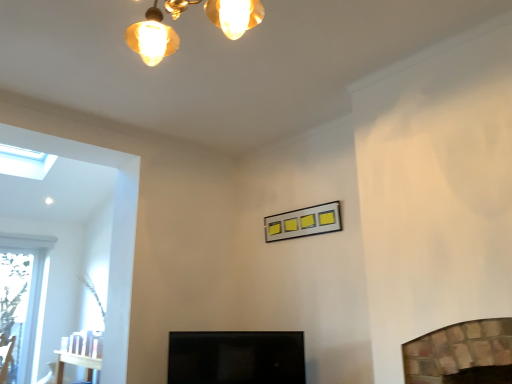
Question: Considering the relative sizes of black glossy screen door at center and metallic silver picture frame at center in the image provided, is black glossy screen door at center thinner than metallic silver picture frame at center?

Choices:
 (A) yes
 (B) no

Answer: (B)

Question: Is black glossy screen door at center to the left of metallic silver picture frame at center from the viewer's perspective?

Choices:
 (A) yes
 (B) no

Answer: (A)

Question: Considering the relative sizes of black glossy screen door at center and metallic silver picture frame at center in the image provided, is black glossy screen door at center taller than metallic silver picture frame at center?

Choices:
 (A) yes
 (B) no

Answer: (A)

Question: Is black glossy screen door at center completely or partially outside of metallic silver picture frame at center?

Choices:
 (A) yes
 (B) no

Answer: (A)

Question: Is black glossy screen door at center wider than metallic silver picture frame at center?

Choices:
 (A) yes
 (B) no

Answer: (A)

Question: In the image, is black glossy screen door at center positioned in front of or behind metallic silver picture frame at center?

Choices:
 (A) behind
 (B) front

Answer: (B)

Question: In terms of height, does black glossy screen door at center look taller or shorter compared to metallic silver picture frame at center?

Choices:
 (A) tall
 (B) short

Answer: (A)

Question: Is black glossy screen door at center wider or thinner than metallic silver picture frame at center?

Choices:
 (A) wide
 (B) thin

Answer: (A)

Question: Considering the positions of point click(287, 372) and point click(298, 216), is point click(287, 372) closer or farther from the camera than point click(298, 216)?

Choices:
 (A) farther
 (B) closer

Answer: (B)

Question: Considering the relative positions of transparent glass skylight at upper left and black glossy screen door at center in the image provided, is transparent glass skylight at upper left to the left or to the right of black glossy screen door at center?

Choices:
 (A) right
 (B) left

Answer: (B)

Question: From the image's perspective, is transparent glass skylight at upper left above or below black glossy screen door at center?

Choices:
 (A) below
 (B) above

Answer: (B)

Question: From a real-world perspective, is transparent glass skylight at upper left positioned above or below black glossy screen door at center?

Choices:
 (A) below
 (B) above

Answer: (B)

Question: Considering the positions of point (40, 173) and point (200, 345), is point (40, 173) closer or farther from the camera than point (200, 345)?

Choices:
 (A) closer
 (B) farther

Answer: (B)

Question: From the image's perspective, is black glossy screen door at center above or below transparent glass skylight at upper left?

Choices:
 (A) below
 (B) above

Answer: (A)

Question: In terms of height, does black glossy screen door at center look taller or shorter compared to transparent glass skylight at upper left?

Choices:
 (A) short
 (B) tall

Answer: (A)